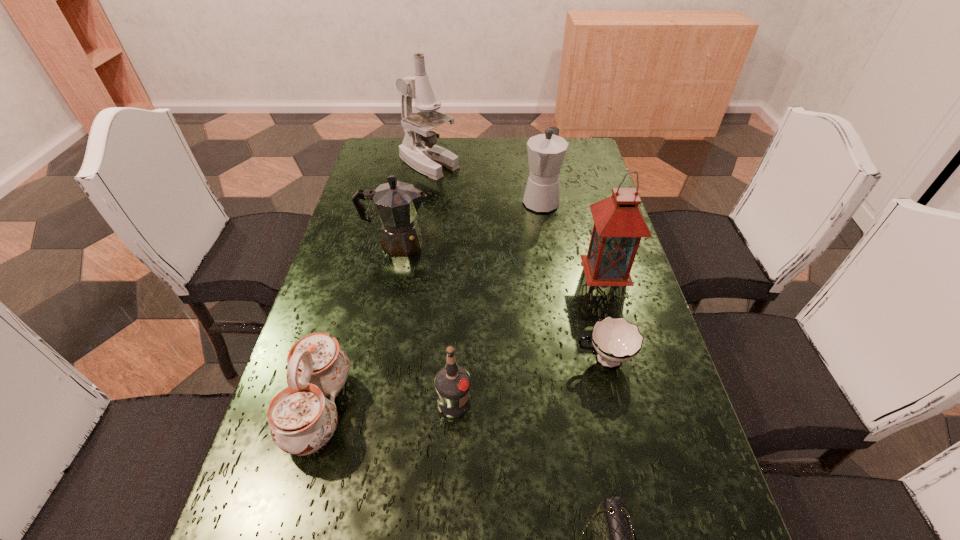
I want to click on free location that satisfies the following two spatial constraints: 1. on the pouring side of the nearer coffeepot; 2. on the side of the cup with the handle, so click(x=374, y=359).